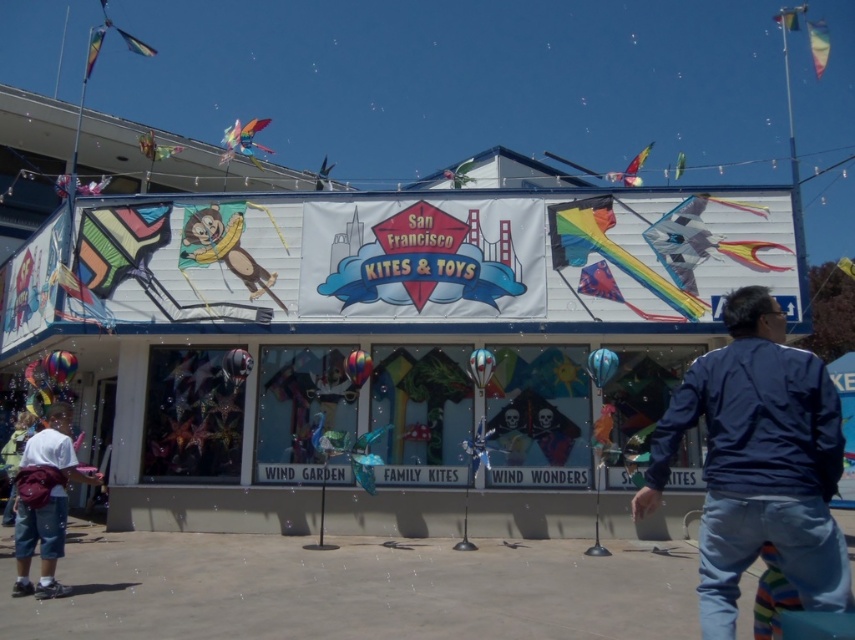
You are a customer standing in front of the San Francisco Kites and Toys store. You see a blue fabric jacket at lower right. Can you estimate its location using coordinates?

The blue fabric jacket at lower right is located at coordinates point [758,461].

You are a customer looking to purchase a gift for a child. You see the blue fabric jacket at lower right and the metallic silver monkey at upper center displayed in the store window. Which item is bigger in size?

The blue fabric jacket at lower right has a larger size compared to the metallic silver monkey at upper center, so the blue fabric jacket at lower right is bigger in size.

You are a customer standing in front of the San Francisco Kites and Toys store. You see a white cotton shirt at lower left and a translucent plastic kite at upper center. Which item is closer to you?

The white cotton shirt at lower left is closer to you because it is in front of the translucent plastic kite at upper center.